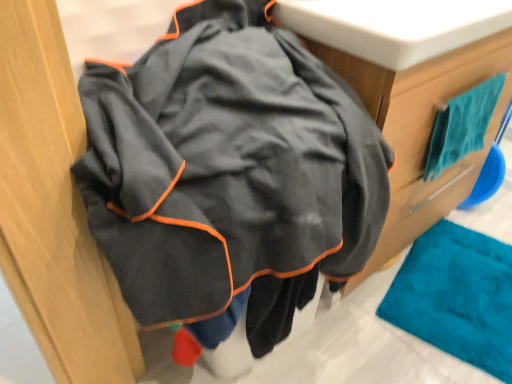
Find the location of `free space in front of teal fabric towel at upper right`. free space in front of teal fabric towel at upper right is located at coordinates (421, 320).